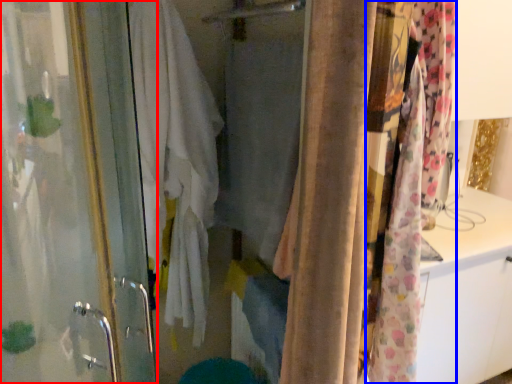
Question: Which object appears closest to the camera in this image, screen door (highlighted by a red box) or curtain (highlighted by a blue box)?

Choices:
 (A) screen door
 (B) curtain

Answer: (A)